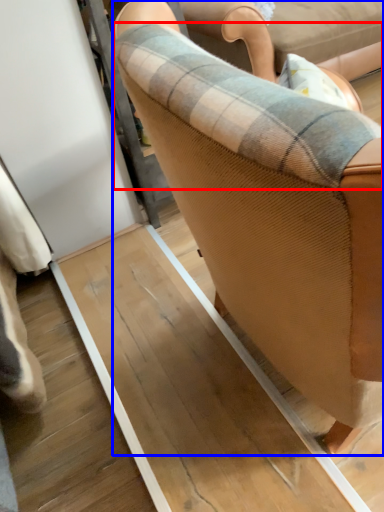
Question: Which object appears closest to the camera in this image, plaid (highlighted by a red box) or chair (highlighted by a blue box)?

Choices:
 (A) plaid
 (B) chair

Answer: (B)